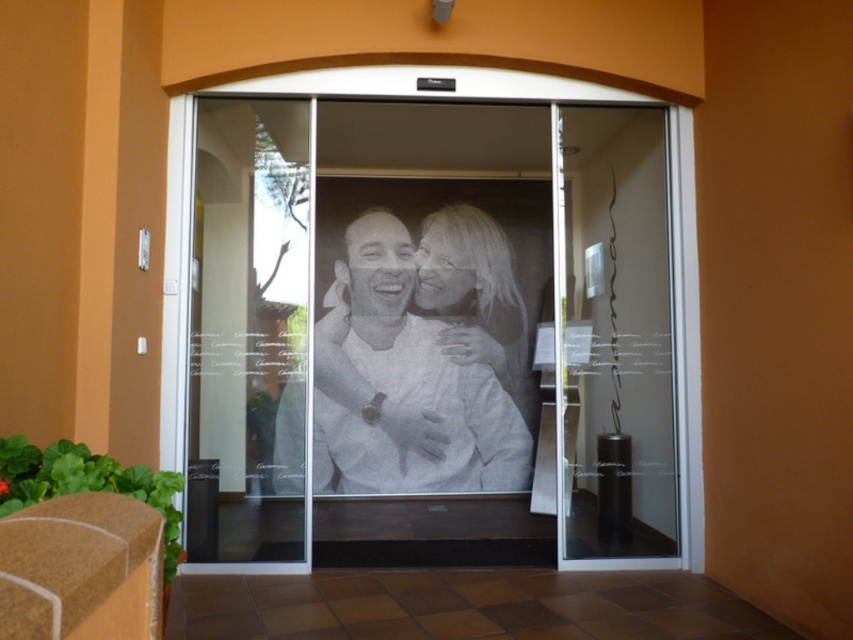
Question: Can you confirm if transparent glass screen door at center is positioned above transparent glass door at center?

Choices:
 (A) no
 (B) yes

Answer: (A)

Question: Estimate the real-world distances between objects in this image. Which object is closer to the etched glass photo at center?

Choices:
 (A) transparent glass door at center
 (B) transparent glass screen door at center

Answer: (B)

Question: Which of the following is the farthest from the observer?

Choices:
 (A) (252, 108)
 (B) (352, 262)

Answer: (B)

Question: Can you confirm if transparent glass screen door at center is bigger than etched glass photo at center?

Choices:
 (A) yes
 (B) no

Answer: (A)

Question: Among these objects, which one is nearest to the camera?

Choices:
 (A) transparent glass door at center
 (B) etched glass photo at center

Answer: (A)

Question: Is transparent glass screen door at center below transparent glass door at center?

Choices:
 (A) yes
 (B) no

Answer: (A)